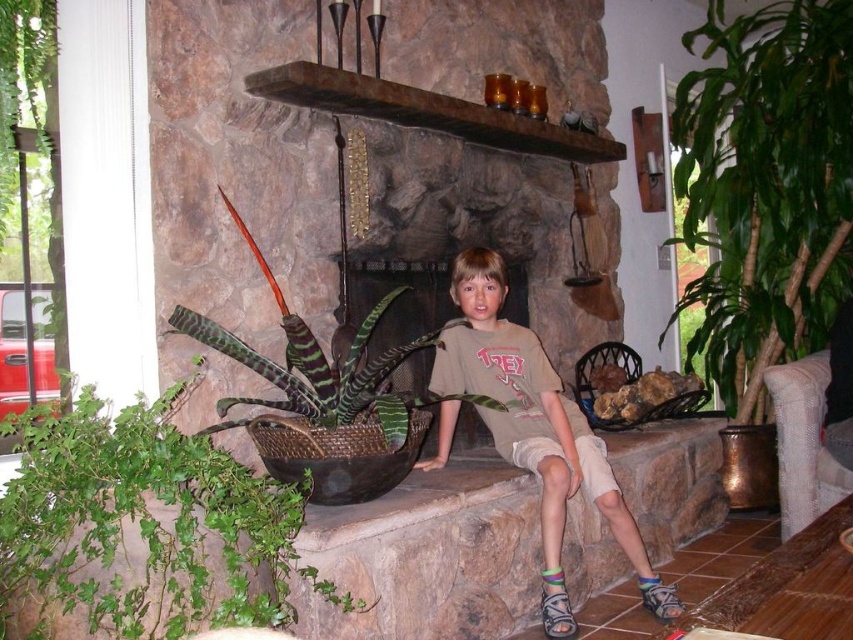
Question: Is green leafy plant at right to the left of green woven basket at lower left from the viewer's perspective?

Choices:
 (A) yes
 (B) no

Answer: (B)

Question: Which object is closer to the camera taking this photo?

Choices:
 (A) brown stone ledge at center
 (B) green woven basket at lower left

Answer: (B)

Question: Which object appears farthest from the camera in this image?

Choices:
 (A) green leafy plant at right
 (B) brown stone ledge at center

Answer: (A)

Question: Which point is farther to the camera?

Choices:
 (A) rustic wood mantle at upper center
 (B) brown stone ledge at center

Answer: (A)

Question: Where is green woven basket at lower left located in relation to rustic wood mantle at upper center in the image?

Choices:
 (A) left
 (B) right

Answer: (A)

Question: From the image, what is the correct spatial relationship of green leafy plant at right in relation to green striped leaves at center?

Choices:
 (A) above
 (B) below

Answer: (A)